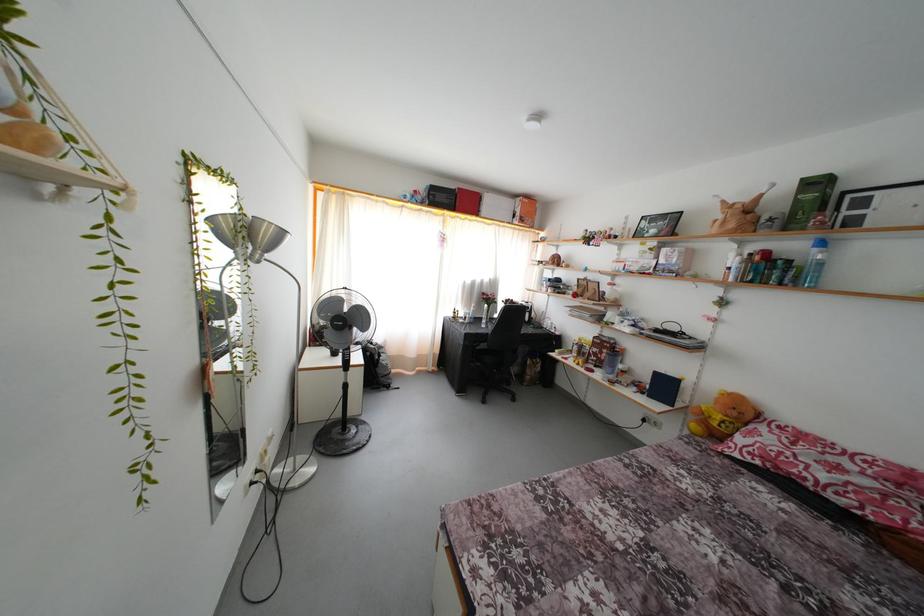
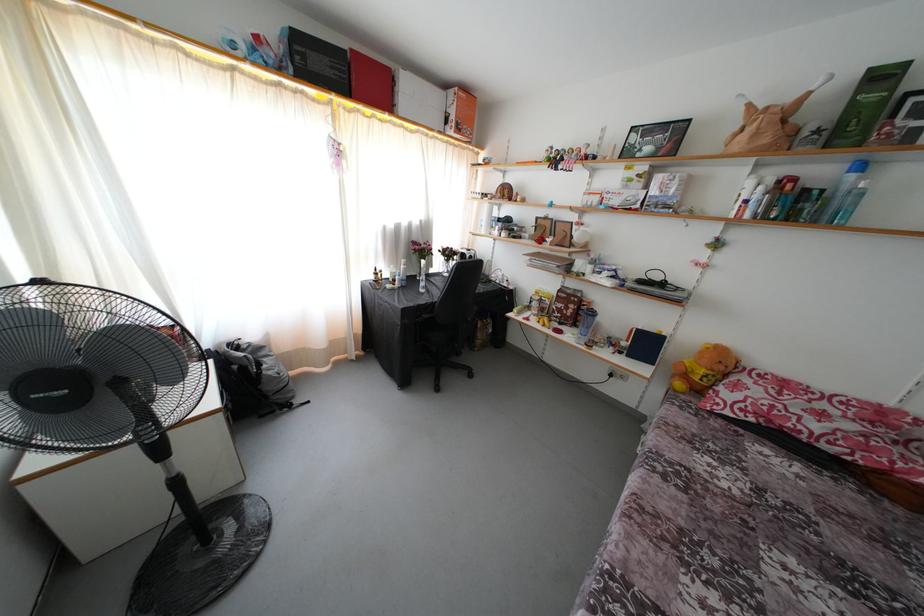
Question: The camera is either moving clockwise (left) or counter-clockwise (right) around the object. The first image is from the beginning of the video and the second image is from the end. Is the camera moving left or right when shooting the video?

Choices:
 (A) Left
 (B) Right

Answer: (A)